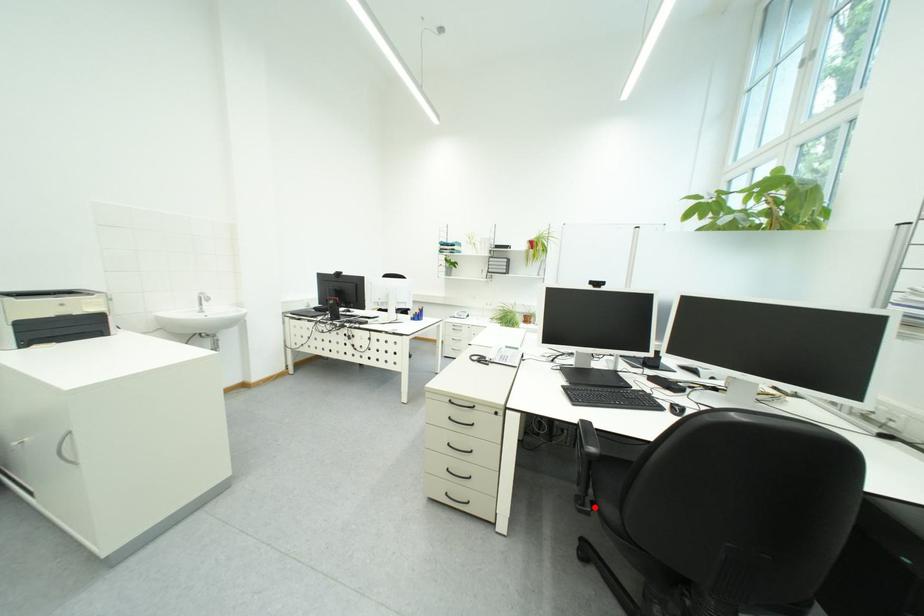
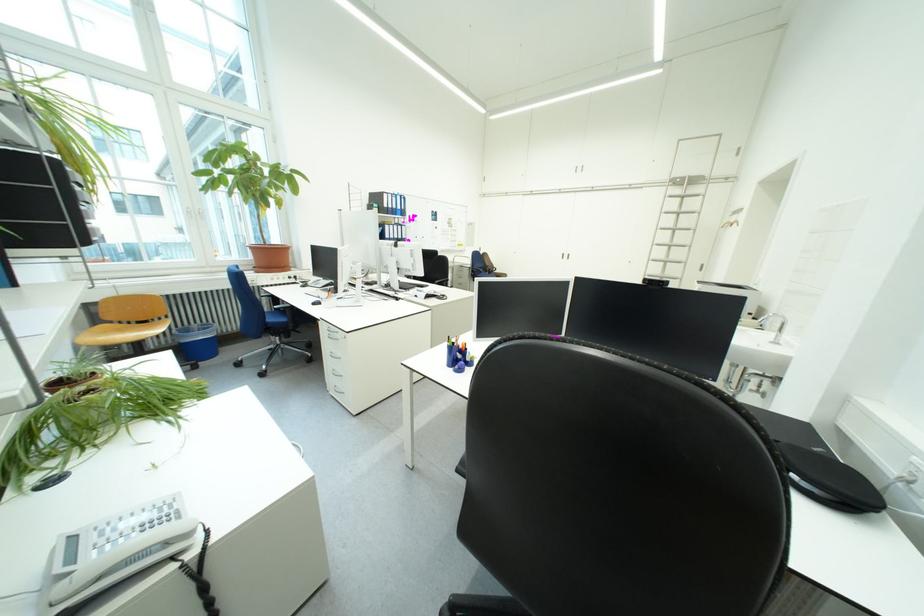
Question: I am providing you with two images of the same scene from different viewpoints. A red point is marked on the first image. At the location where the point appears in image 1, is it still visible in image 2?

Choices:
 (A) Yes
 (B) No

Answer: (B)